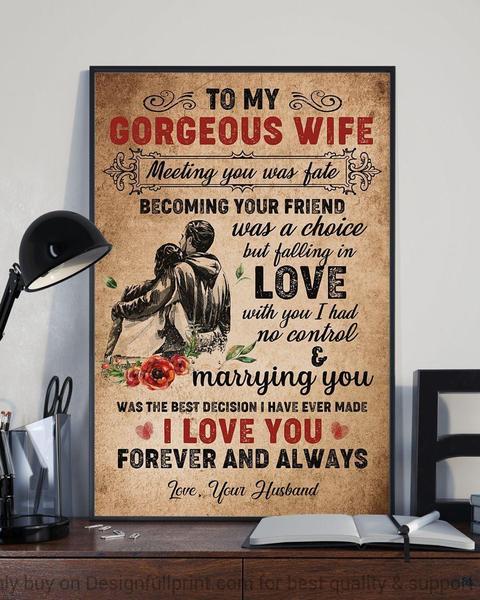
I want to click on lamp, so click(35, 264).